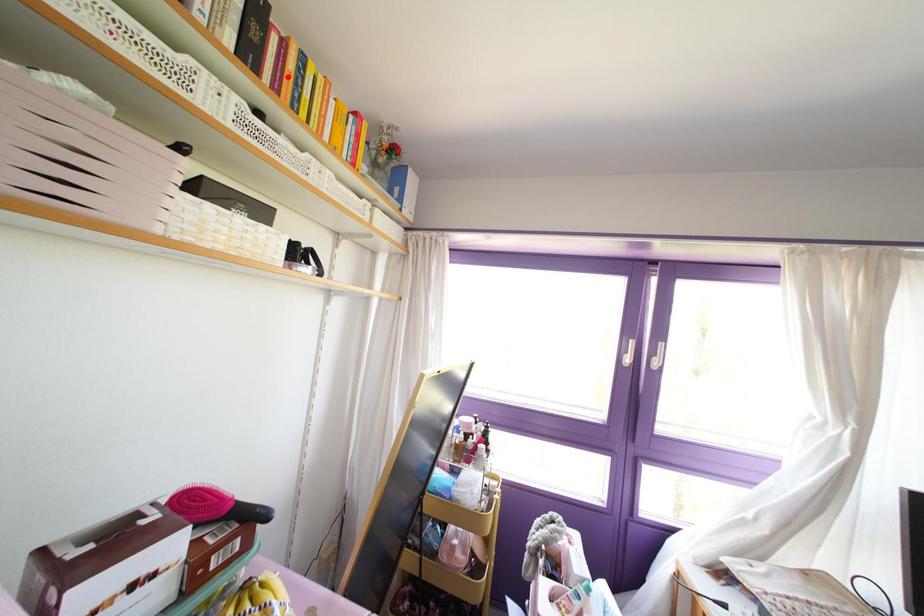
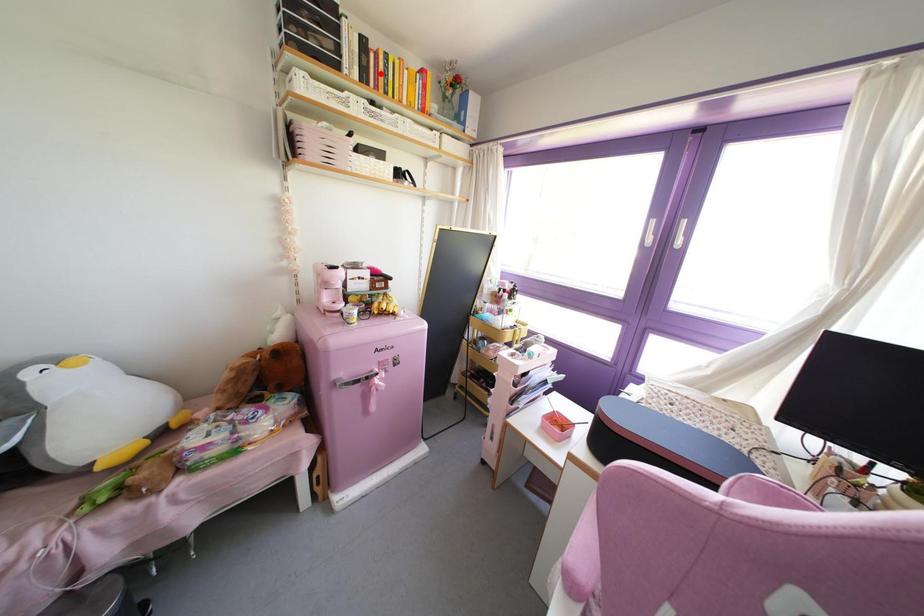
I am providing you with two images of the same scene from different viewpoints. A red point is marked on the first image and another point is marked on the second image. Is the red point in image1 aligned with the point shown in image2?

Yes